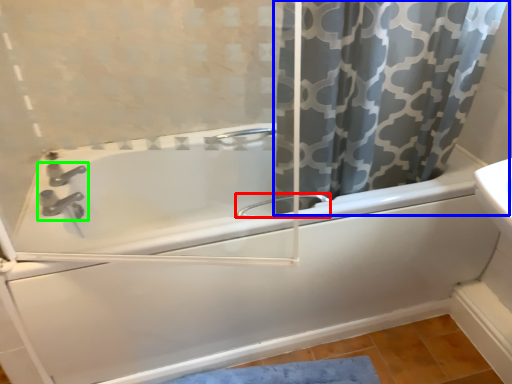
Question: Estimate the real-world distances between objects in this image. Which object is closer to faucet (highlighted by a red box), curtain (highlighted by a blue box) or tap (highlighted by a green box)?

Choices:
 (A) curtain
 (B) tap

Answer: (A)